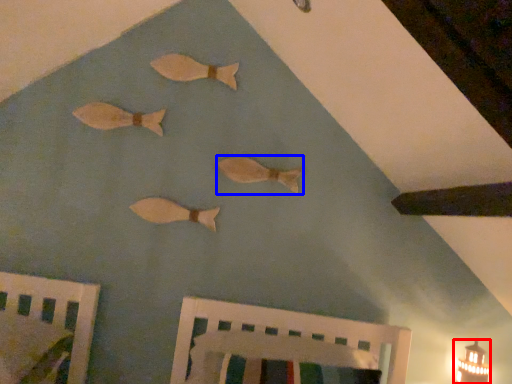
Question: Which of the following is the closest to the observer, light fixture (highlighted by a red box) or fish (highlighted by a blue box)?

Choices:
 (A) light fixture
 (B) fish

Answer: (A)